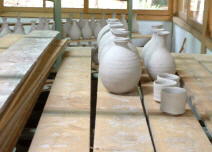
This screenshot has height=152, width=212. I want to click on green vertical shelving, so click(x=128, y=5), click(x=56, y=12).